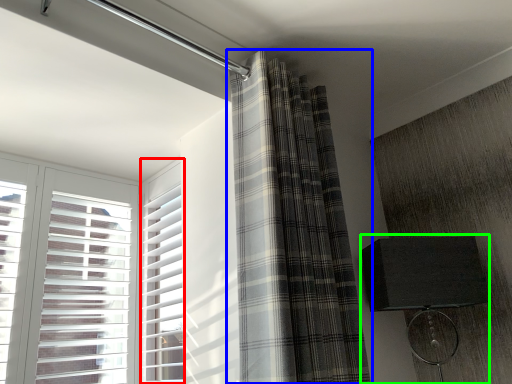
Question: Based on their relative distances, which object is farther from window frame (highlighted by a red box)? Choose from curtain (highlighted by a blue box) and table lamp (highlighted by a green box).

Choices:
 (A) curtain
 (B) table lamp

Answer: (B)